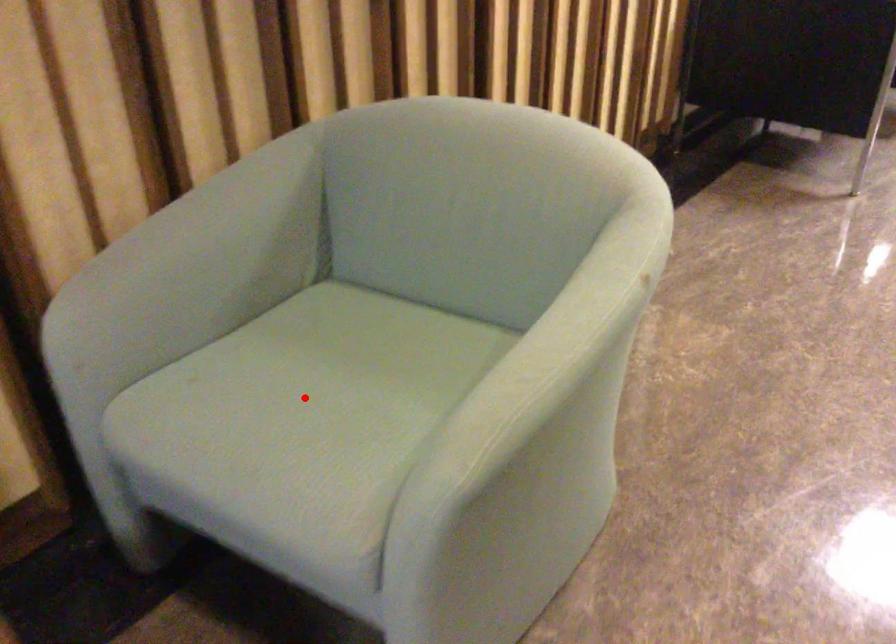
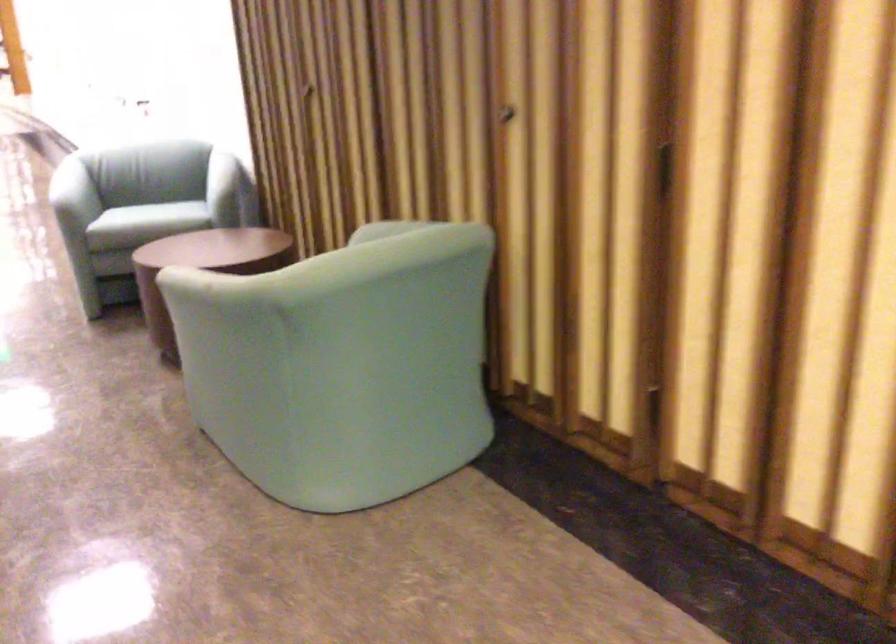
Question: I am providing you with two images of the same scene from different viewpoints. A red point is marked on the first image. Is the red point's position out of view in image 2?

Choices:
 (A) Yes
 (B) No

Answer: (A)